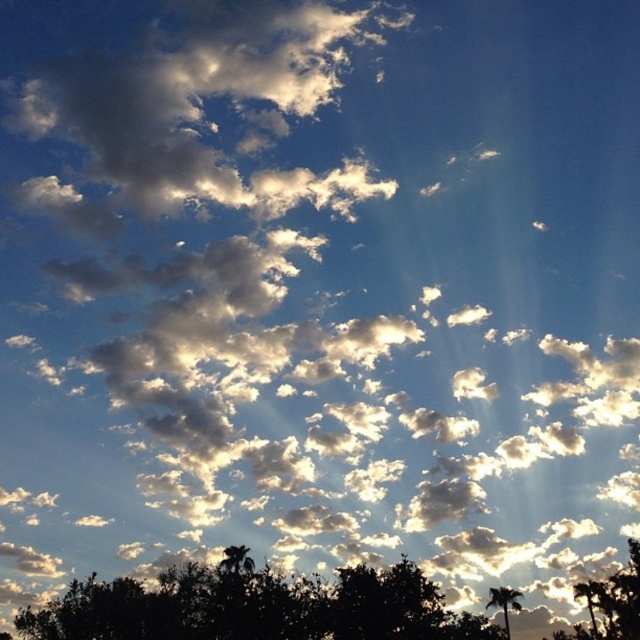
You are standing in a field and see the silhouette leafy tree at lower center and the green leafy tree at lower right. Which tree is positioned more to the right side?

The green leafy tree at lower right is positioned more to the right side.

You are standing in a field and see the silhouette leafy tree at lower center and the green leafy tree at lower right. Which tree is taller?

The silhouette leafy tree at lower center is much taller than the green leafy tree at lower right.